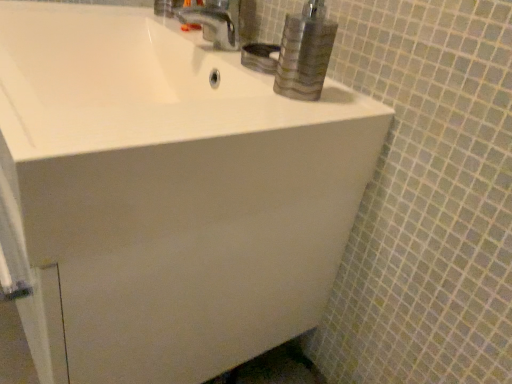
Question: Is white glossy sink at upper center inside the boundaries of metallic silver faucet at upper center, or outside?

Choices:
 (A) outside
 (B) inside

Answer: (A)

Question: Does point (244, 117) appear closer or farther from the camera than point (226, 38)?

Choices:
 (A) farther
 (B) closer

Answer: (B)

Question: Visually, is white glossy sink at upper center positioned to the left or to the right of metallic silver faucet at upper center?

Choices:
 (A) left
 (B) right

Answer: (A)

Question: Considering the positions of metallic silver faucet at upper center and white glossy sink at upper center in the image, is metallic silver faucet at upper center taller or shorter than white glossy sink at upper center?

Choices:
 (A) short
 (B) tall

Answer: (B)

Question: Based on their sizes in the image, would you say metallic silver faucet at upper center is bigger or smaller than white glossy sink at upper center?

Choices:
 (A) big
 (B) small

Answer: (B)

Question: Considering the positions of point (229, 1) and point (94, 77), is point (229, 1) closer or farther from the camera than point (94, 77)?

Choices:
 (A) farther
 (B) closer

Answer: (A)

Question: In terms of width, does metallic silver faucet at upper center look wider or thinner when compared to white glossy sink at upper center?

Choices:
 (A) thin
 (B) wide

Answer: (A)